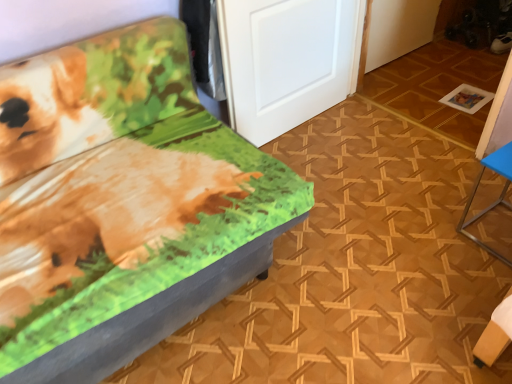
I want to click on vacant space in front of white matte door at center, so [x=337, y=172].